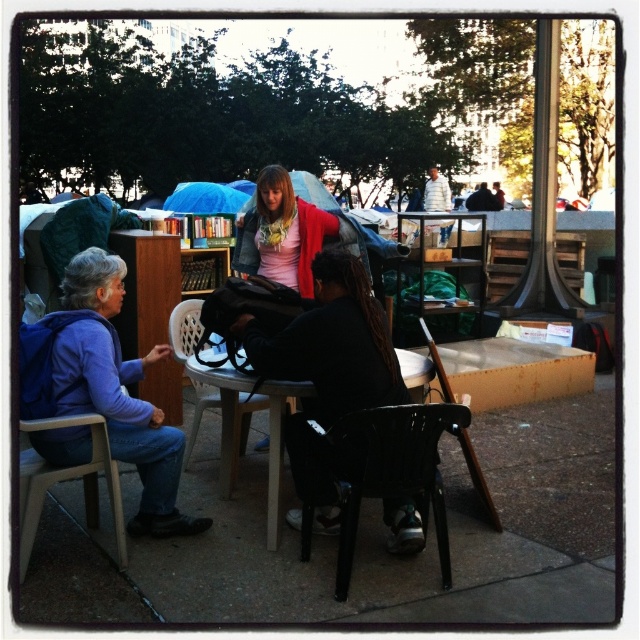
You are standing in the park and see the black plastic folding chair at lower center and the matte pink shirt at center. Which object is positioned lower in the image?

The black plastic folding chair at lower center is positioned lower than the matte pink shirt at center in the image.

You are standing in the park and see two people in the image. One is wearing a white cotton shirt at upper right and the other has a dark gray jacket at center. Which one is positioned more to the left side of the scene?

The white cotton shirt at upper right is positioned to the left of the dark gray jacket at center, so the white cotton shirt at upper right is more to the left in the scene.

You are standing at the origin point of the coordinate system in the image. You want to move towards the black plastic folding chair at lower center. What are the coordinates you need to move to?

The coordinates you need to move to are 0.734 in the x direction and 0.620 in the y direction.